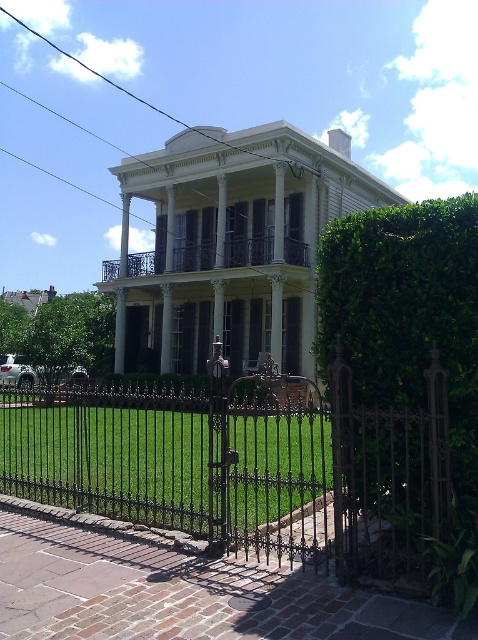
Question: Which point appears farthest from the camera in this image?

Choices:
 (A) (454, 336)
 (B) (290, 444)

Answer: (B)

Question: Is black wrought iron gate at center thinner than green leafy hedge at right?

Choices:
 (A) no
 (B) yes

Answer: (A)

Question: From the image, what is the correct spatial relationship of black wrought iron gate at center in relation to white wrought iron porch at center?

Choices:
 (A) below
 (B) above

Answer: (A)

Question: Is green leafy hedge at right above white wrought iron porch at center?

Choices:
 (A) yes
 (B) no

Answer: (B)

Question: Which of the following is the closest to the observer?

Choices:
 (A) black wrought iron gate at center
 (B) white wrought iron porch at center
 (C) green leafy hedge at right

Answer: (C)

Question: Among these objects, which one is farthest from the camera?

Choices:
 (A) black wrought iron gate at center
 (B) white wrought iron porch at center

Answer: (B)